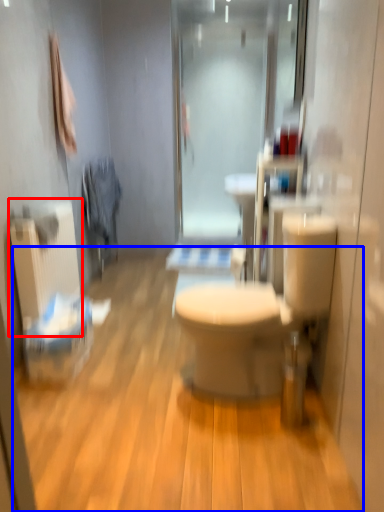
Question: Among these objects, which one is farthest to the camera, radiator (highlighted by a red box) or plain (highlighted by a blue box)?

Choices:
 (A) radiator
 (B) plain

Answer: (A)